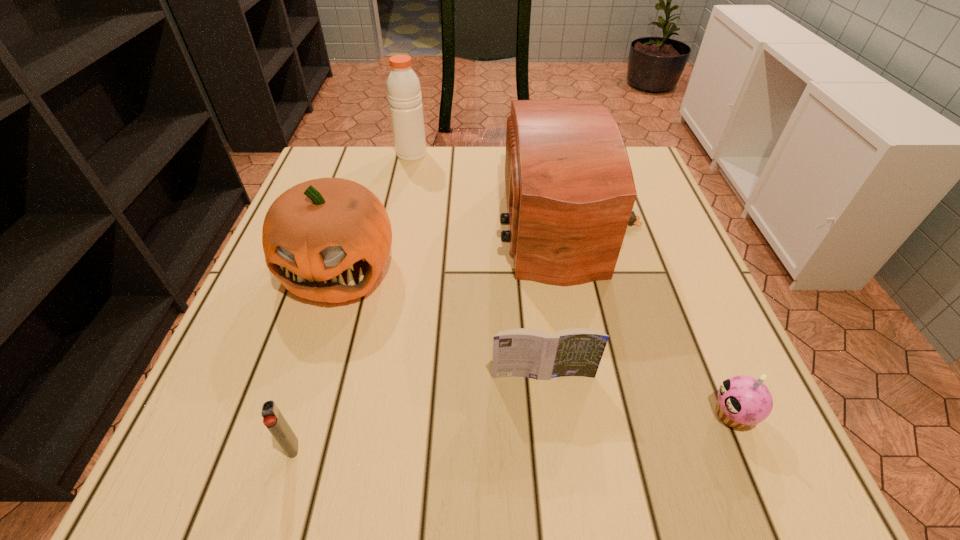
Find the location of `free spot between the pumpkin and the fourth farthest object`. free spot between the pumpkin and the fourth farthest object is located at coordinates (442, 321).

Locate an element on the screen. Image resolution: width=960 pixels, height=540 pixels. unoccupied area between the radio receiver and the shaker is located at coordinates (491, 188).

Identify the location of vacant space in between the farthest object and the radio receiver. (491, 188).

Locate an element on the screen. The image size is (960, 540). object that is the closest to the shaker is located at coordinates (570, 191).

Select which object appears as the fourth closest to the third nearest object. Please provide its 2D coordinates. Your answer should be formatted as a tuple, i.e. [(x, y)], where the tuple contains the x and y coordinates of a point satisfying the conditions above.

[(273, 419)]

Image resolution: width=960 pixels, height=540 pixels. I want to click on free space that satisfies the following two spatial constraints: 1. on the face of the igniter; 2. on the left side of the third tallest object, so 283,448.

Locate an element on the screen. Image resolution: width=960 pixels, height=540 pixels. free location that satisfies the following two spatial constraints: 1. on the back side of the farthest object; 2. on the left side of the igniter is located at coordinates (380, 154).

You are a GUI agent. You are given a task and a screenshot of the screen. Output one action in this format:
    pyautogui.click(x=<x>, y=<y>)
    Task: Click on the free space that satisfies the following two spatial constraints: 1. on the face of the nearest object; 2. on the left side of the third tallest object
    The height and width of the screenshot is (540, 960).
    Given the screenshot: What is the action you would take?
    pyautogui.click(x=283, y=448)